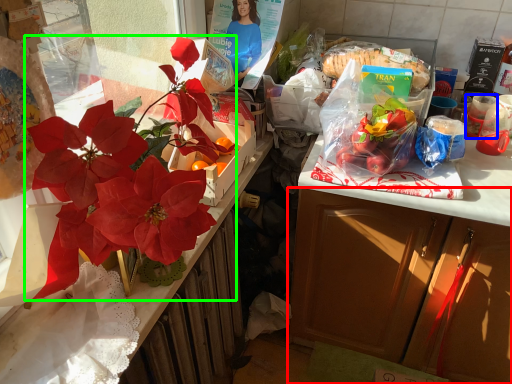
Question: Which object is positioned farthest from cabinetry (highlighted by a red box)? Select from coffee cup (highlighted by a blue box) and flower (highlighted by a green box).

Choices:
 (A) coffee cup
 (B) flower

Answer: (B)